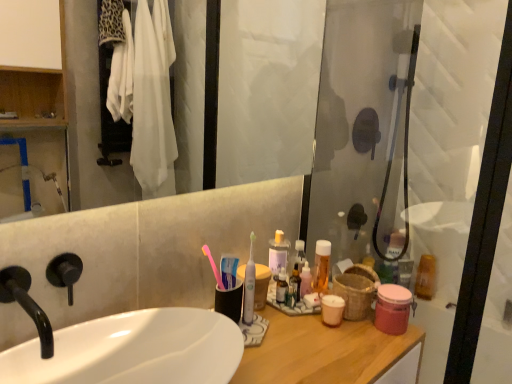
Question: Does pink plastic toothbrush at center, marked as the 2th toothbrush in a right-to-left arrangement, appear on the right side of white glossy sink at center?

Choices:
 (A) yes
 (B) no

Answer: (A)

Question: Is pink plastic toothbrush at center, marked as the 2th toothbrush in a right-to-left arrangement, taller than white glossy sink at center?

Choices:
 (A) no
 (B) yes

Answer: (B)

Question: Is pink plastic toothbrush at center, the 1th toothbrush from the left, facing away from white glossy sink at center?

Choices:
 (A) no
 (B) yes

Answer: (A)

Question: Can you confirm if pink plastic toothbrush at center, the 1th toothbrush from the left, is thinner than white glossy sink at center?

Choices:
 (A) yes
 (B) no

Answer: (A)

Question: Are pink plastic toothbrush at center, marked as the 2th toothbrush in a right-to-left arrangement, and white glossy sink at center located far from each other?

Choices:
 (A) no
 (B) yes

Answer: (A)

Question: Considering the positions of white glossy sink at center and transparent glass shower door at right in the image, is white glossy sink at center bigger or smaller than transparent glass shower door at right?

Choices:
 (A) big
 (B) small

Answer: (B)

Question: Considering the positions of white glossy sink at center and transparent glass shower door at right in the image, is white glossy sink at center taller or shorter than transparent glass shower door at right?

Choices:
 (A) short
 (B) tall

Answer: (A)

Question: From the image's perspective, is white glossy sink at center positioned above or below transparent glass shower door at right?

Choices:
 (A) above
 (B) below

Answer: (B)

Question: Considering the positions of white glossy sink at center and transparent glass shower door at right in the image, is white glossy sink at center wider or thinner than transparent glass shower door at right?

Choices:
 (A) wide
 (B) thin

Answer: (A)

Question: Is pink matte jar at right, acting as the 3th mouthwash starting from the right, in front of or behind translucent plastic mouthwash at center, acting as the 1th mouthwash starting from the left, in the image?

Choices:
 (A) front
 (B) behind

Answer: (A)

Question: Looking at their shapes, would you say pink matte jar at right, the fourth mouthwash viewed from the back, is wider or thinner than translucent plastic mouthwash at center, acting as the 1th mouthwash starting from the left?

Choices:
 (A) wide
 (B) thin

Answer: (A)

Question: Is pink matte jar at right, acting as the 3th mouthwash starting from the right, bigger or smaller than translucent plastic mouthwash at center, the 4th mouthwash viewed from the right?

Choices:
 (A) big
 (B) small

Answer: (A)

Question: Is pink matte jar at right, the fourth mouthwash viewed from the back, inside the boundaries of translucent plastic mouthwash at center, the 4th mouthwash viewed from the right, or outside?

Choices:
 (A) inside
 (B) outside

Answer: (B)

Question: Choose the correct answer: Is translucent plastic mouthwash at upper right, which appears as the 4th mouthwash when viewed from the front, inside black matte faucet at left or outside it?

Choices:
 (A) outside
 (B) inside

Answer: (A)

Question: In the image, is translucent plastic mouthwash at upper right, which is the first mouthwash in back-to-front order, on the left side or the right side of black matte faucet at left?

Choices:
 (A) left
 (B) right

Answer: (B)